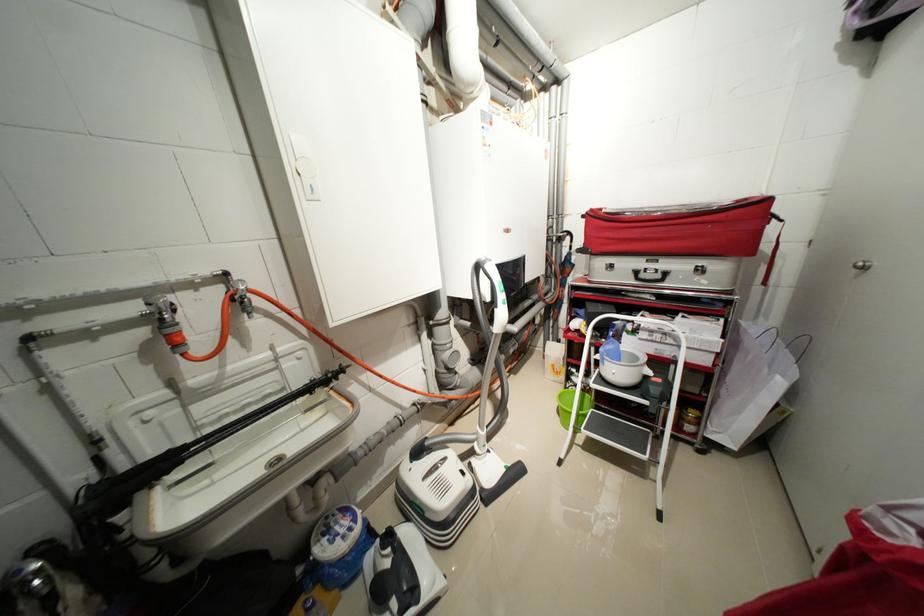
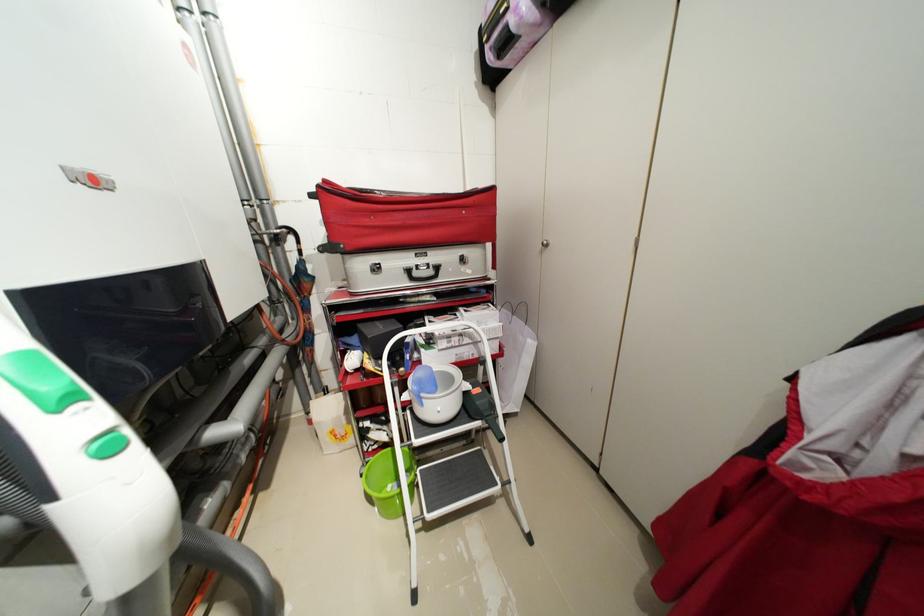
Find the pixel in the second image that matches (604,358) in the first image.

(412, 398)